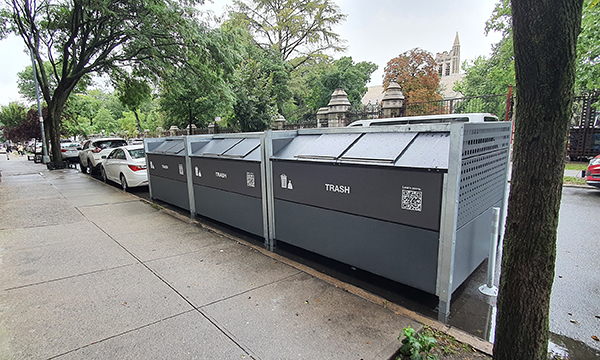
Where is `trash bin lids`? trash bin lids is located at coordinates (163, 144), (178, 149), (219, 146), (241, 150), (332, 149), (373, 151).